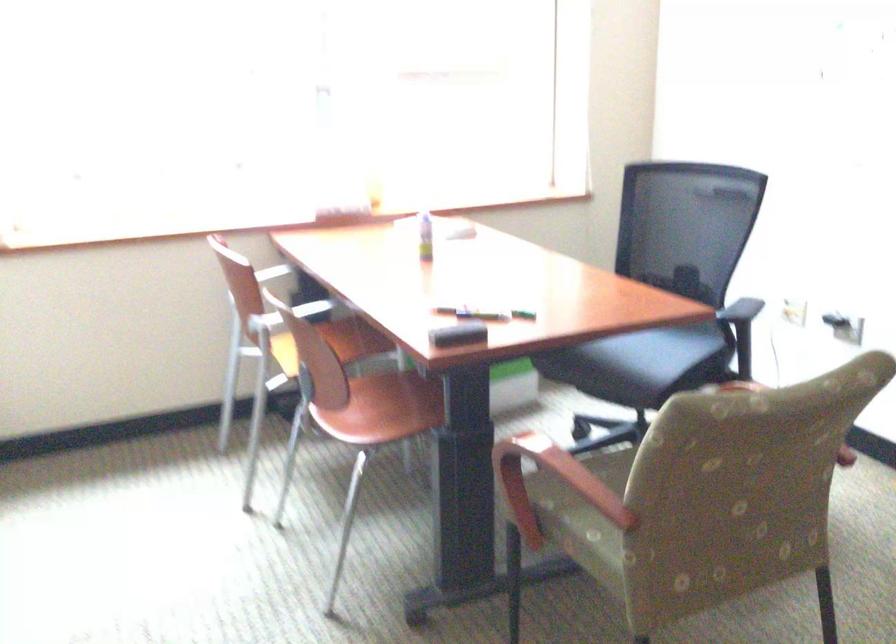
Which object does [425,236] point to?

This point indicates the small bottle.